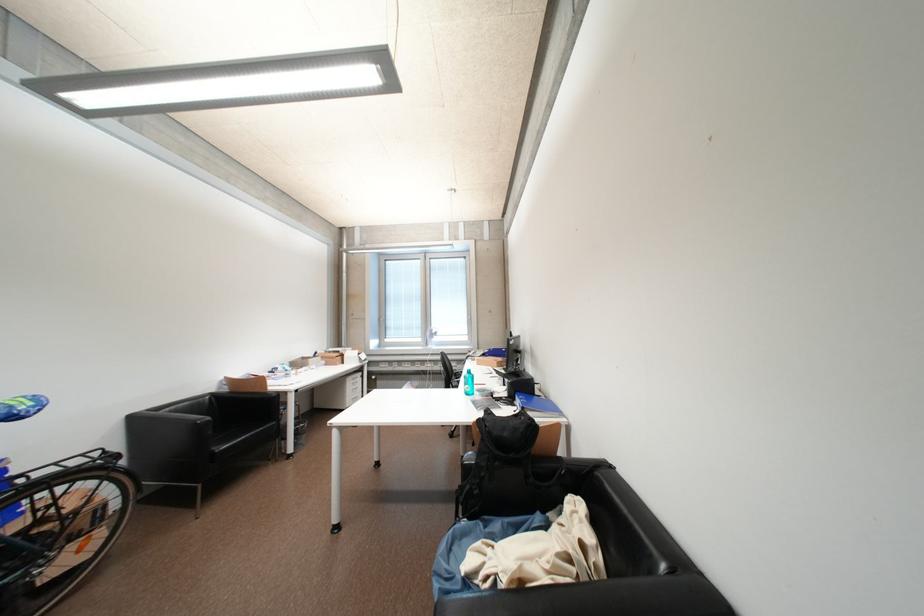
Identify the location of light blue bottle. The height and width of the screenshot is (616, 924). pyautogui.click(x=468, y=382).